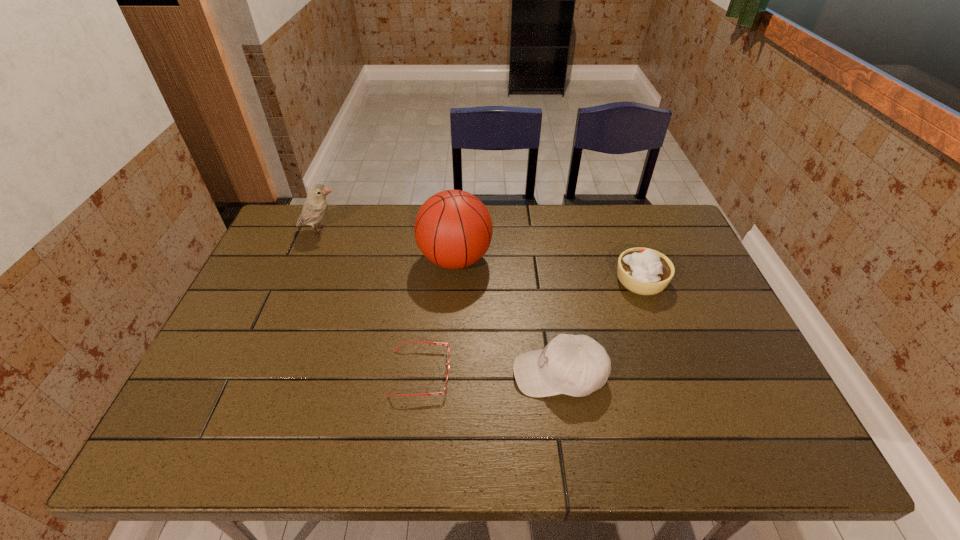
This screenshot has height=540, width=960. Find the location of `vacant space located on the front-facing side of the fourth object from left to right`. vacant space located on the front-facing side of the fourth object from left to right is located at coordinates (389, 374).

Locate an element on the screen. The width and height of the screenshot is (960, 540). free space located 0.400m on the front-facing side of the fourth object from left to right is located at coordinates (348, 374).

Find the location of a particular element. free space located 0.300m on the lenses of the shortest object is located at coordinates (574, 373).

Identify the location of basketball at the far edge. Image resolution: width=960 pixels, height=540 pixels. (453, 229).

Find the location of a particular element. bird that is at the far edge is located at coordinates click(x=315, y=206).

I want to click on object that is positioned at the left edge, so click(315, 206).

Where is `object situated at the right edge`? This screenshot has height=540, width=960. object situated at the right edge is located at coordinates (644, 271).

The image size is (960, 540). In order to click on object present at the far left corner in this screenshot , I will do `click(315, 206)`.

In the image, there is a desktop. Where is `blank space at the far edge`? This screenshot has width=960, height=540. blank space at the far edge is located at coordinates 591,240.

Image resolution: width=960 pixels, height=540 pixels. Find the location of `vacant area at the near edge`. vacant area at the near edge is located at coordinates (372, 427).